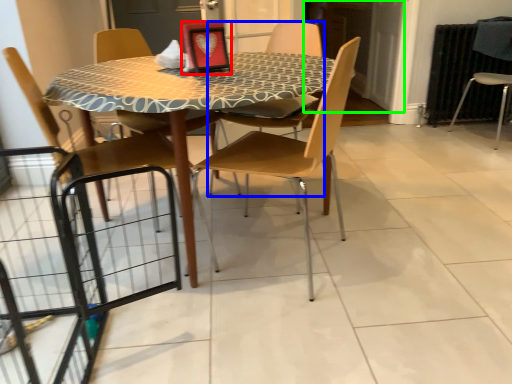
Question: Which object is the closest to the picture frame (highlighted by a red box)? Choose among these: chair (highlighted by a blue box) or screen door (highlighted by a green box).

Choices:
 (A) chair
 (B) screen door

Answer: (A)